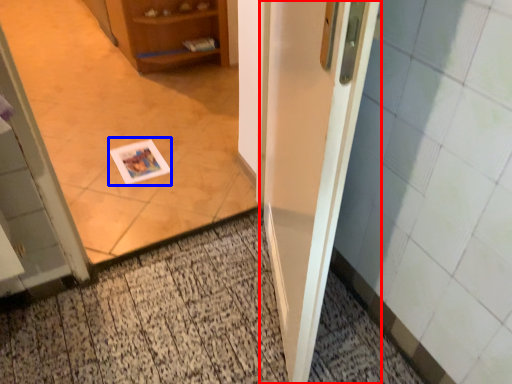
Question: Which of the following is the farthest to the observer, door (highlighted by a red box) or postcard (highlighted by a blue box)?

Choices:
 (A) door
 (B) postcard

Answer: (B)